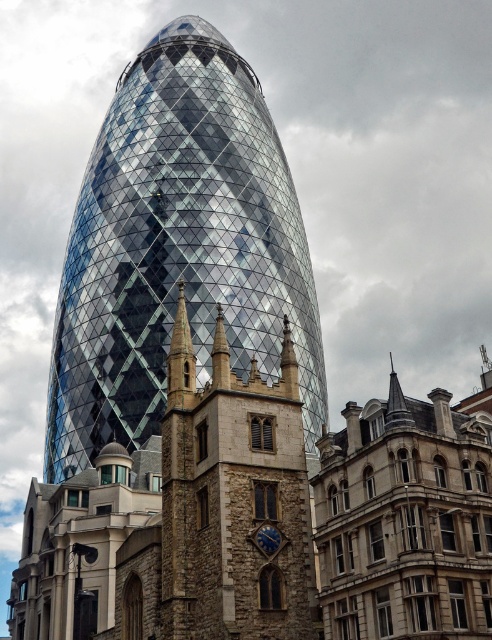
Describe the element at coordinates (177, 248) in the screenshot. I see `geometric glass tower at center` at that location.

Measure the distance between geometric glass tower at center and stone clock tower at center.

geometric glass tower at center and stone clock tower at center are 81.93 feet apart.

Who is more forward, (246, 314) or (233, 390)?

Point (233, 390) is more forward.

Identify the location of geometric glass tower at center. Image resolution: width=492 pixels, height=640 pixels. 177,248.